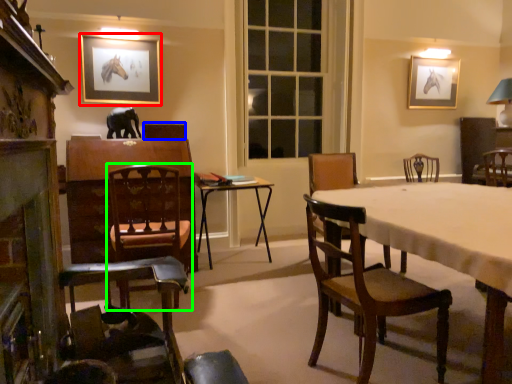
Question: Which object is positioned farthest from picture frame (highlighted by a red box)? Select from armchair (highlighted by a blue box) and chair (highlighted by a green box).

Choices:
 (A) armchair
 (B) chair

Answer: (B)